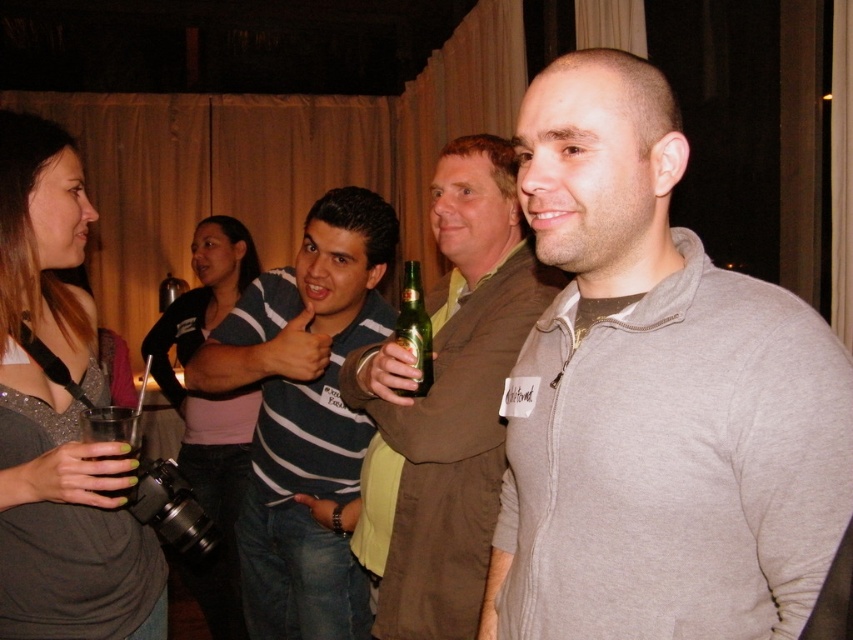
You are at a party and want to take a photo of the matte gray dress at left and the striped cotton shirt at center. Which one should you focus on first if you want to capture both in the same frame?

The matte gray dress at left is located above the striped cotton shirt at center, so you should focus on the matte gray dress at left first to ensure both are in the frame.

You are standing at the entrance of the party and want to take a photo of the matte gray dress at left and the striped cotton shirt at center. Which one should you focus on first to ensure both are in sharp focus?

The matte gray dress at left is closer to the viewer than the striped cotton shirt at center. To ensure both are in sharp focus, focus on the matte gray dress at left first since it is closer, and the striped cotton shirt at center will fall within the depth of field if the distance between them is within the camera setting.